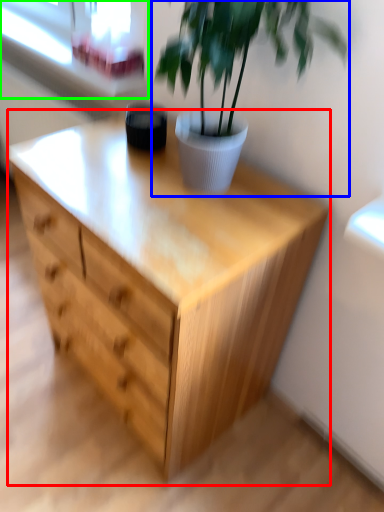
Question: Based on their relative distances, which object is nearer to chest of drawers (highlighted by a red box)? Choose from houseplant (highlighted by a blue box) and window frame (highlighted by a green box).

Choices:
 (A) houseplant
 (B) window frame

Answer: (A)